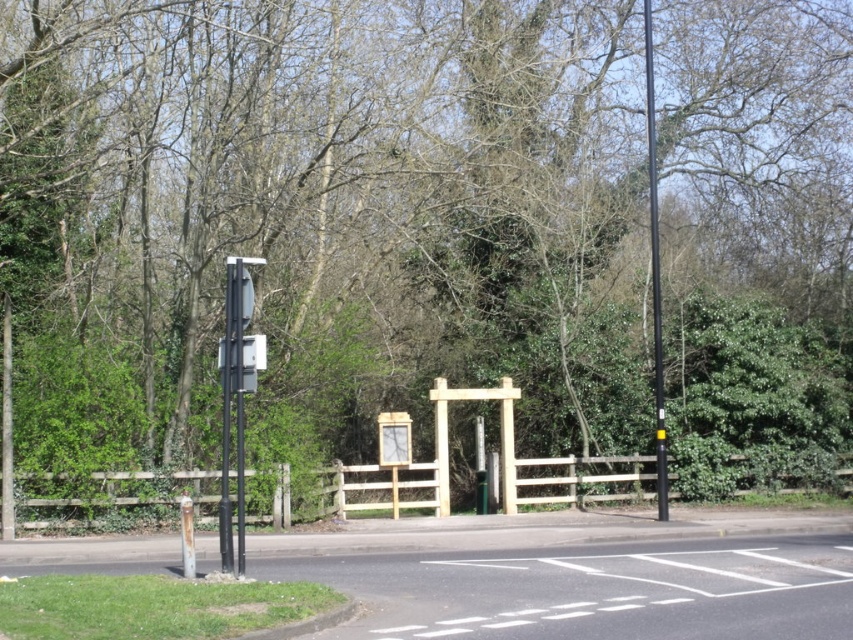
Question: Among these objects, which one is farthest from the camera?

Choices:
 (A) black smooth pole at right
 (B) wooden fence at center
 (C) wooden frame at center
 (D) metallic street sign at left

Answer: (C)

Question: Is the position of metallic street sign at left more distant than that of wooden frame at center?

Choices:
 (A) yes
 (B) no

Answer: (B)

Question: Is wooden fence at center further to camera compared to black smooth pole at right?

Choices:
 (A) yes
 (B) no

Answer: (B)

Question: Estimate the real-world distances between objects in this image. Which object is farther from the wooden fence at center?

Choices:
 (A) wooden frame at center
 (B) metallic street sign at left

Answer: (B)

Question: Does metallic street sign at left have a lesser width compared to wooden frame at center?

Choices:
 (A) no
 (B) yes

Answer: (B)

Question: Which object is the farthest from the metallic street sign at left?

Choices:
 (A) black smooth pole at right
 (B) wooden fence at center
 (C) wooden frame at center

Answer: (A)